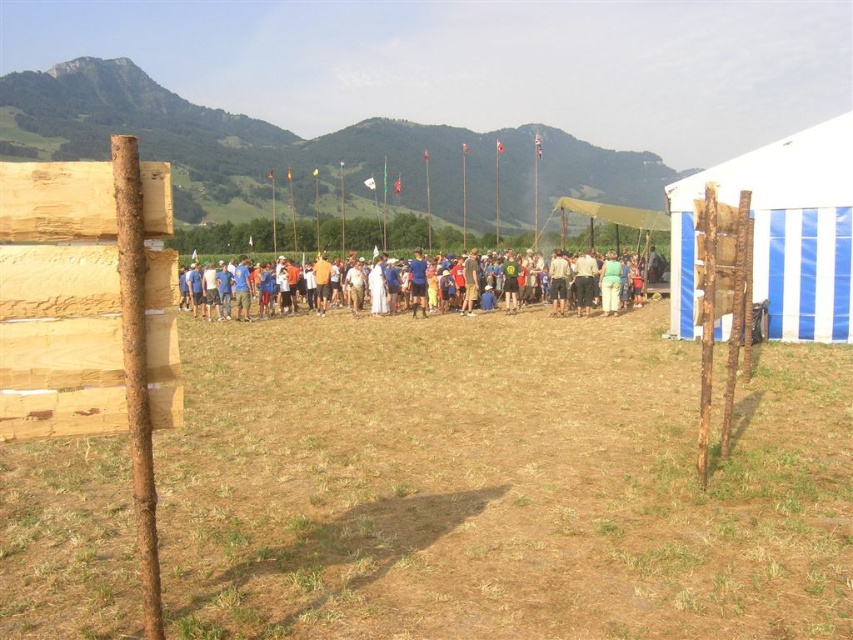
Question: Among these objects, which one is nearest to the camera?

Choices:
 (A) blue fabric people at center
 (B) brown dry grass at center

Answer: (B)

Question: Does blue striped tent at right have a larger size compared to blue fabric people at center?

Choices:
 (A) yes
 (B) no

Answer: (B)

Question: Which of the following is the closest to the observer?

Choices:
 (A) (636, 426)
 (B) (654, 268)

Answer: (A)

Question: Where is brown dry grass at center located in relation to blue fabric people at center in the image?

Choices:
 (A) right
 (B) left

Answer: (A)

Question: Among these points, which one is farthest from the camera?

Choices:
 (A) (659, 292)
 (B) (790, 234)

Answer: (A)

Question: Can you confirm if brown dry grass at center is positioned above blue fabric people at center?

Choices:
 (A) no
 (B) yes

Answer: (A)